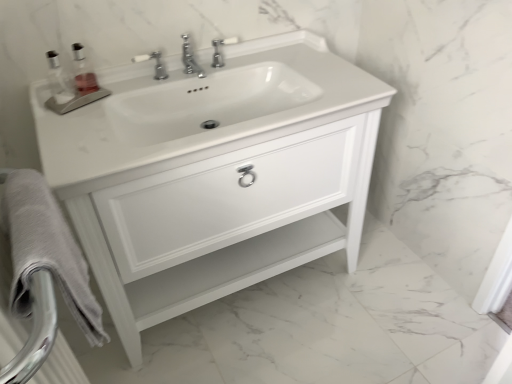
Question: From a real-world perspective, is white glossy sink at center located higher than white glossy cabinet at center?

Choices:
 (A) yes
 (B) no

Answer: (A)

Question: Does white glossy sink at center have a larger size compared to white glossy cabinet at center?

Choices:
 (A) no
 (B) yes

Answer: (A)

Question: Does white glossy sink at center have a lesser height compared to white glossy cabinet at center?

Choices:
 (A) no
 (B) yes

Answer: (B)

Question: Can you confirm if white glossy sink at center is positioned to the left of white glossy cabinet at center?

Choices:
 (A) yes
 (B) no

Answer: (A)

Question: From the image's perspective, is white glossy sink at center below white glossy cabinet at center?

Choices:
 (A) yes
 (B) no

Answer: (B)

Question: Relative to clear glass soap dispenser at upper left, is gray cotton bath towel at lower left in front or behind?

Choices:
 (A) behind
 (B) front

Answer: (B)

Question: From the image's perspective, relative to clear glass soap dispenser at upper left, is gray cotton bath towel at lower left above or below?

Choices:
 (A) above
 (B) below

Answer: (B)

Question: Would you say gray cotton bath towel at lower left is to the left or to the right of clear glass soap dispenser at upper left in the picture?

Choices:
 (A) right
 (B) left

Answer: (A)

Question: Does point (83, 264) appear closer or farther from the camera than point (76, 89)?

Choices:
 (A) farther
 (B) closer

Answer: (B)

Question: Is white glossy cabinet at center situated inside white glossy sink at center or outside?

Choices:
 (A) outside
 (B) inside

Answer: (A)

Question: From a real-world perspective, is white glossy cabinet at center above or below white glossy sink at center?

Choices:
 (A) above
 (B) below

Answer: (B)

Question: Does point (181, 102) appear closer or farther from the camera than point (74, 147)?

Choices:
 (A) closer
 (B) farther

Answer: (B)

Question: From their relative heights in the image, would you say white glossy cabinet at center is taller or shorter than white glossy sink at center?

Choices:
 (A) tall
 (B) short

Answer: (A)

Question: Looking at the image, does clear glass soap dispenser at upper left seem bigger or smaller compared to white glossy sink at center?

Choices:
 (A) small
 (B) big

Answer: (A)

Question: Is point (77, 56) positioned closer to the camera than point (50, 173)?

Choices:
 (A) farther
 (B) closer

Answer: (A)